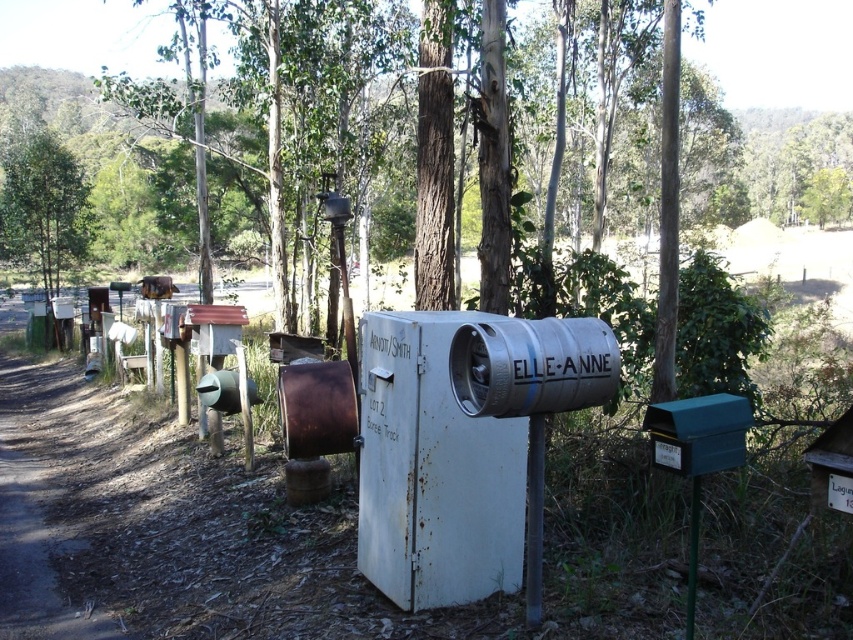
You are a postal worker delivering mail to the area. You notice the rusty metal mailbox at center and the green leafy tree at upper left. Which object is taller?

The rusty metal mailbox at center is much taller than the green leafy tree at upper left.

You are a postal worker delivering mail to the ARNOTT SMITH mailbox. You see the rusty metal mailbox at center and the green leafy tree at upper left in your line of sight. Which object is closer to you?

The rusty metal mailbox at center is closer to you because it is in front of the green leafy tree at upper left.

You are a postal worker delivering mail to the area. You need to determine the best path to avoid hitting the rusty metal mailbox at center and the green leafy tree at upper left. Which object is wider and should you give more space to?

The rusty metal mailbox at center is wider than the green leafy tree at upper left, so you should give more space to the rusty metal mailbox at center to avoid collision.